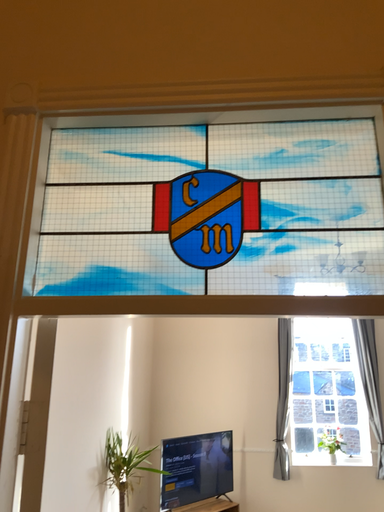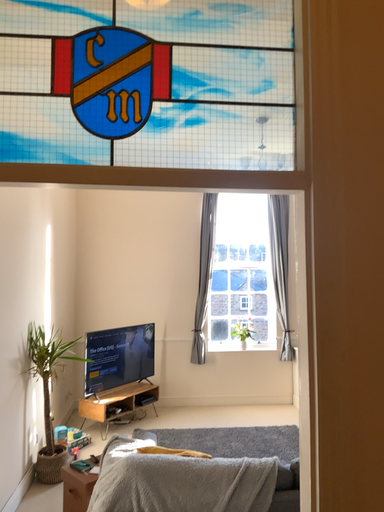
Question: Which way did the camera rotate in the video?

Choices:
 (A) rotated left
 (B) rotated right

Answer: (B)